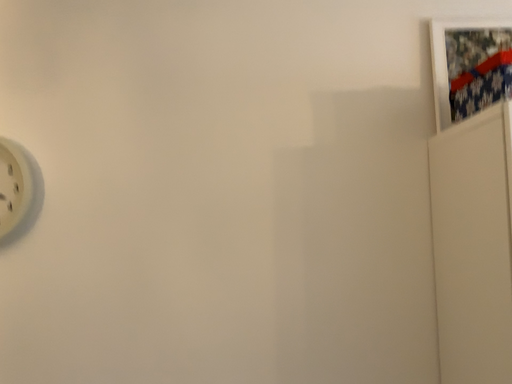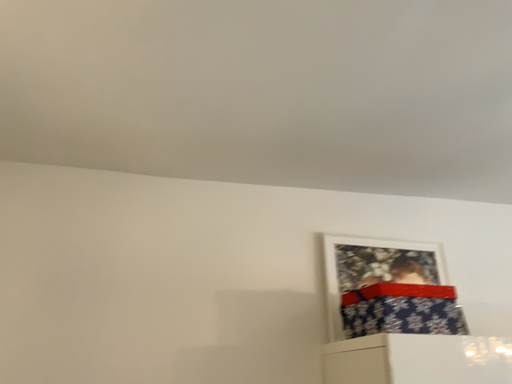
Question: How did the camera likely rotate when shooting the video?

Choices:
 (A) rotated upward
 (B) rotated downward

Answer: (A)